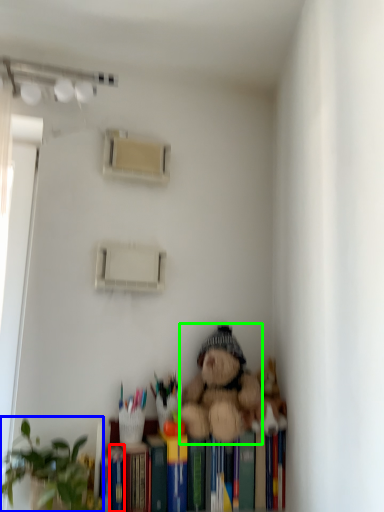
Question: Which is nearer to the paperback book (highlighted by a red box)? houseplant (highlighted by a blue box) or teddy bear (highlighted by a green box).

Choices:
 (A) houseplant
 (B) teddy bear

Answer: (A)